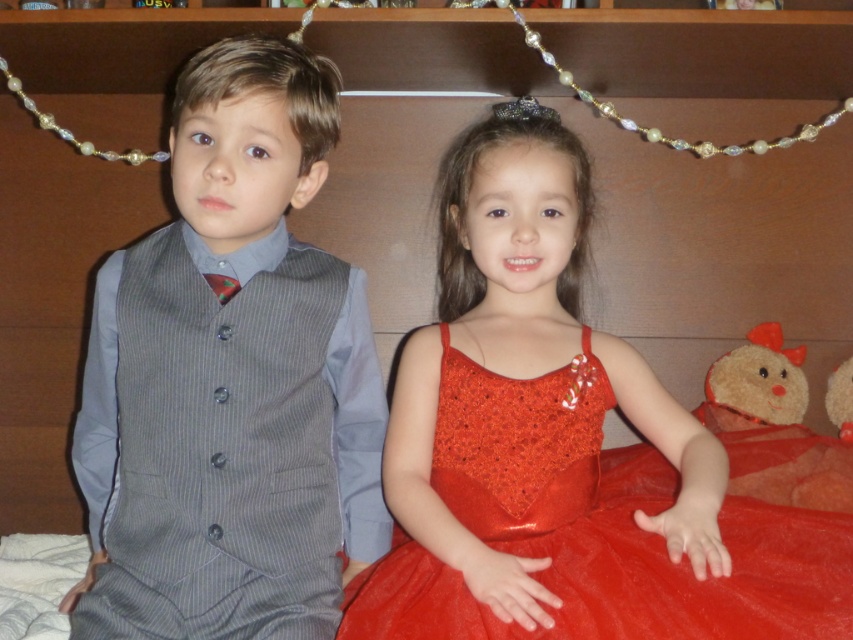
You are a photographer standing in front of the two children. You want to take a closeup shot of the gray pinstripe vest at left without moving the children. Can you move your camera closer to the vest to get a better shot?

The gray pinstripe vest at left is 36.16 inches from viewer. Since you can move the camera closer, you can get a better shot by moving the camera within that distance.

You are a photographer taking a picture of the gray pinstripe vest at left. What coordinates should you focus on to capture it perfectly?

You should focus on the coordinates point [231,380] to capture the gray pinstripe vest at left perfectly.